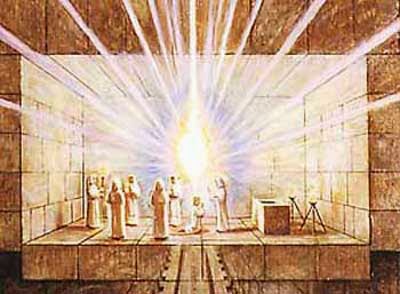
Where is `bench`? bench is located at coordinates (271, 215).